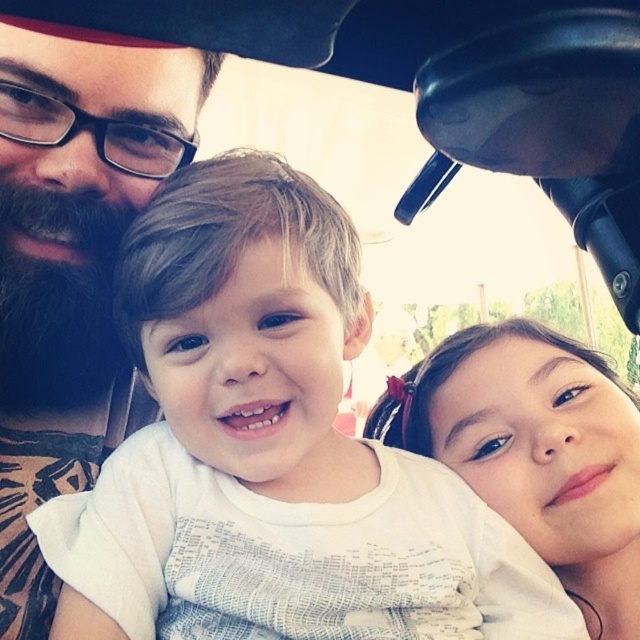
You are taking a selfie with three people in a car. You notice a point at coordinates (272, 451). What object is located at that point?

The point at coordinates (272, 451) is occupied by the white cotton shirt at center.

You are trying to locate the point with coordinates (72, 260) in the image. Based on the scene description, where is this point located?

The point with coordinates (72, 260) is on the bearded man at left.

You are taking a photo of the bearded man at left and the smooth skin face at right. Which one will appear larger in the photo?

The bearded man at left will appear larger in the photo because he is in front of the smooth skin face at right.